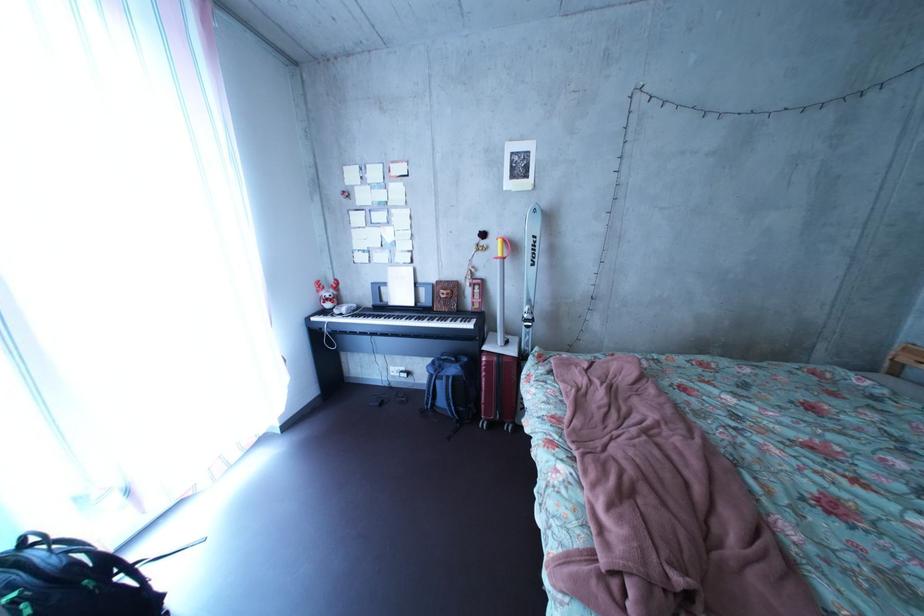
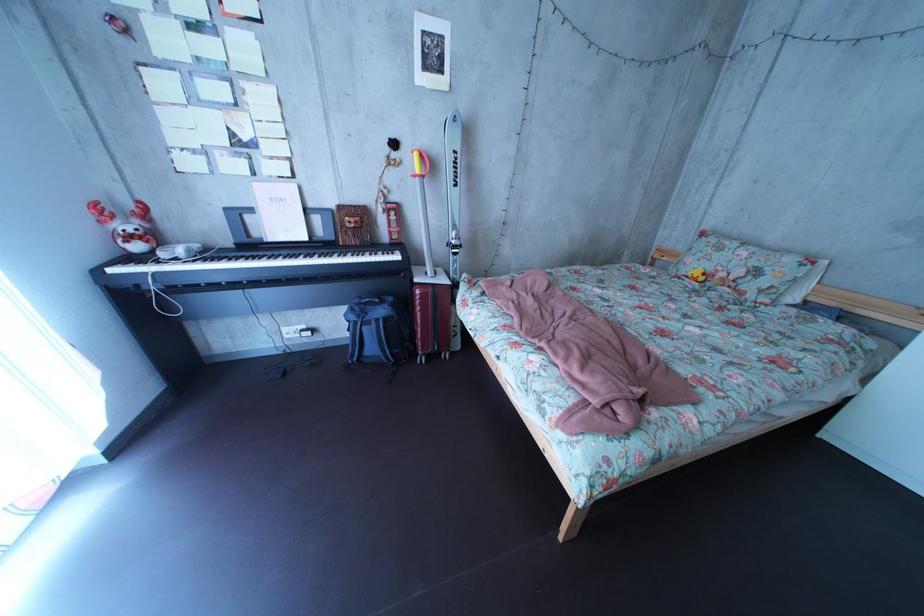
In the second image, find the point that corresponds to point (529, 347) in the first image.

(455, 278)